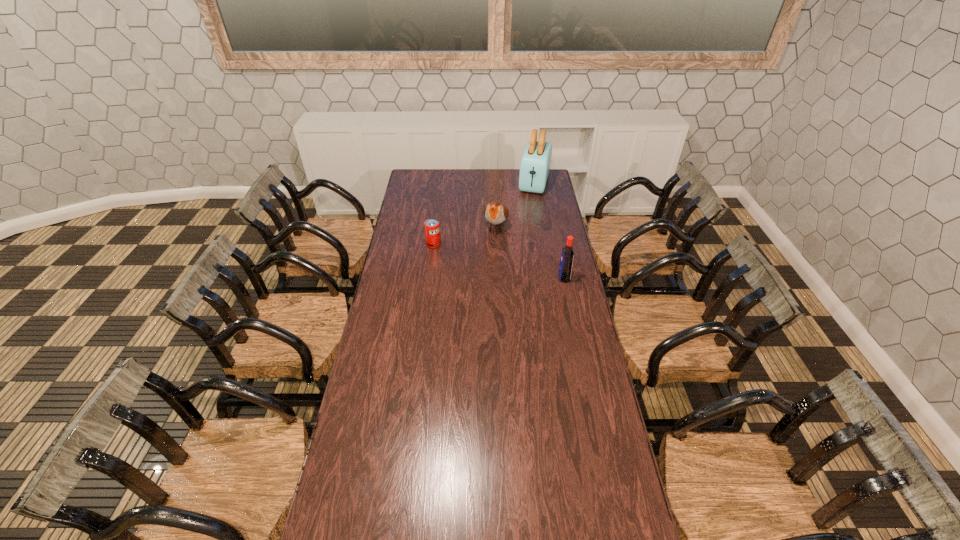
Locate an element on the screen. Image resolution: width=960 pixels, height=540 pixels. vacant space that is in between the can and the third shortest object is located at coordinates (498, 261).

This screenshot has width=960, height=540. I want to click on blank region between the bird and the third shortest object, so click(530, 252).

Locate an element on the screen. This screenshot has height=540, width=960. empty location between the second shortest object and the toaster is located at coordinates (516, 205).

The height and width of the screenshot is (540, 960). I want to click on unoccupied position between the toaster and the nearest object, so click(x=549, y=231).

Identify the location of the second closest object relative to the nearest object. (432, 229).

Locate which object is the second closest to the second nearest object. Please provide its 2D coordinates. Your answer should be formatted as a tuple, i.e. [(x, y)], where the tuple contains the x and y coordinates of a point satisfying the conditions above.

[(565, 267)]

Locate an element on the screen. vacant space that satisfies the following two spatial constraints: 1. on the front side of the toaster; 2. on the front and back of the vodka is located at coordinates (551, 278).

Where is `vacant area that satisfies the following two spatial constraints: 1. on the back side of the tallest object; 2. on the left side of the leftmost object`? vacant area that satisfies the following two spatial constraints: 1. on the back side of the tallest object; 2. on the left side of the leftmost object is located at coordinates (442, 183).

Locate an element on the screen. This screenshot has width=960, height=540. vacant point that satisfies the following two spatial constraints: 1. on the front side of the second tallest object; 2. on the front and back of the third farthest object is located at coordinates (429, 278).

The height and width of the screenshot is (540, 960). Identify the location of vacant point that satisfies the following two spatial constraints: 1. on the back side of the bird; 2. on the left side of the tallest object. (494, 183).